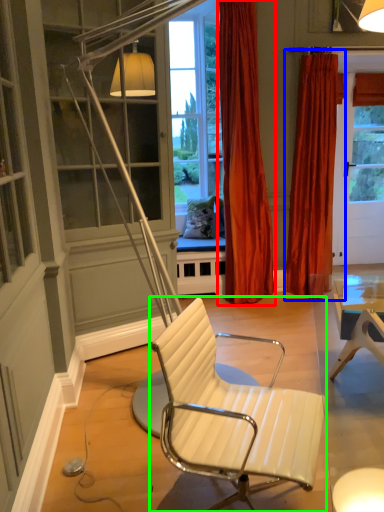
Question: Which object is positioned closest to curtain (highlighted by a red box)? Select from curtain (highlighted by a blue box) and chair (highlighted by a green box).

Choices:
 (A) curtain
 (B) chair

Answer: (A)